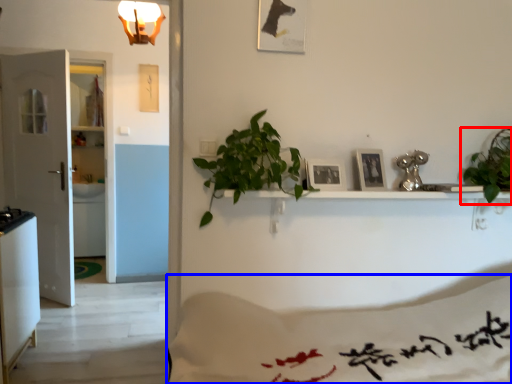
Question: Among these objects, which one is nearest to the camera, houseplant (highlighted by a red box) or sheet (highlighted by a blue box)?

Choices:
 (A) houseplant
 (B) sheet

Answer: (B)